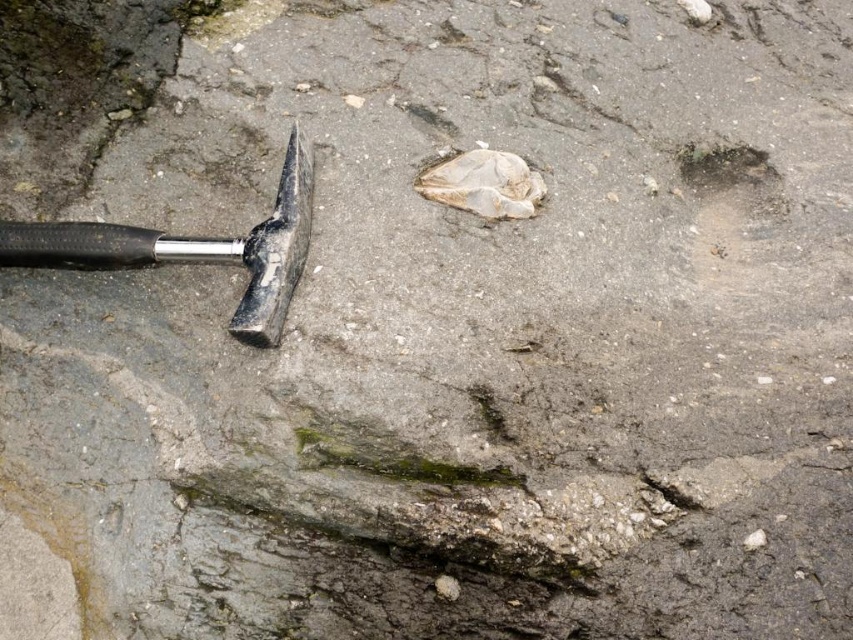
You are a geologist analyzing the rock surface in the image. You need to place the matte black hammer at left precisely at the coordinates provided. What are the coordinates where you should position the hammer?

The coordinates for positioning the matte black hammer at left are at point (193, 248).

You are a geologist holding a measuring tape. You need to determine if the distance between the matte black hammer at left and the smooth gray hole at upper right is more than 2 feet. Based on the image, what is your conclusion?

The distance between the matte black hammer at left and the smooth gray hole at upper right is 26.69 inches, which is more than 2 feet since 24 inches equals 2 feet. Therefore, the distance is indeed greater than 2 feet.

You need to fit the matte black hammer at left into the smooth gray hole at upper right. Based on their sizes, will it be possible?

The matte black hammer at left is wider than the smooth gray hole at upper right, so it cannot fit through the hole.